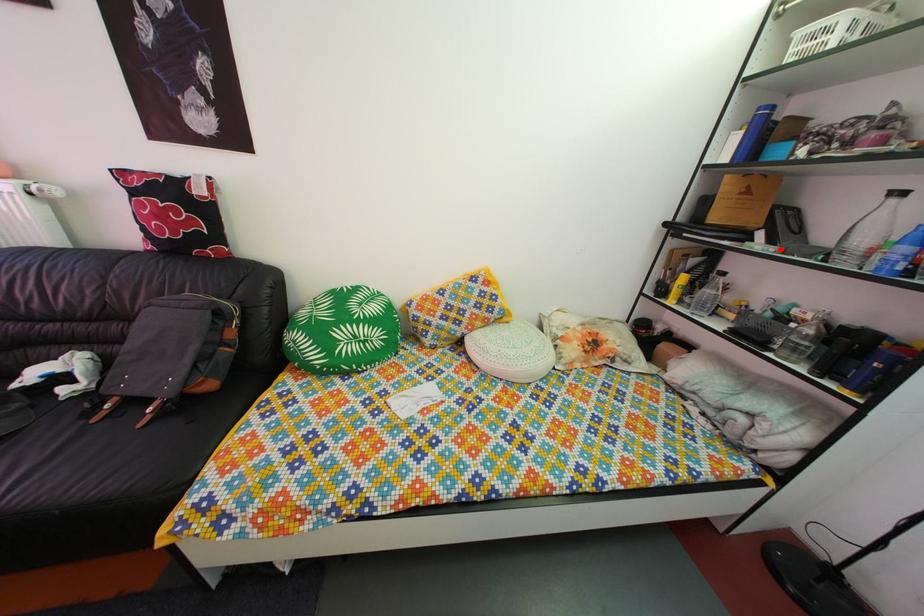
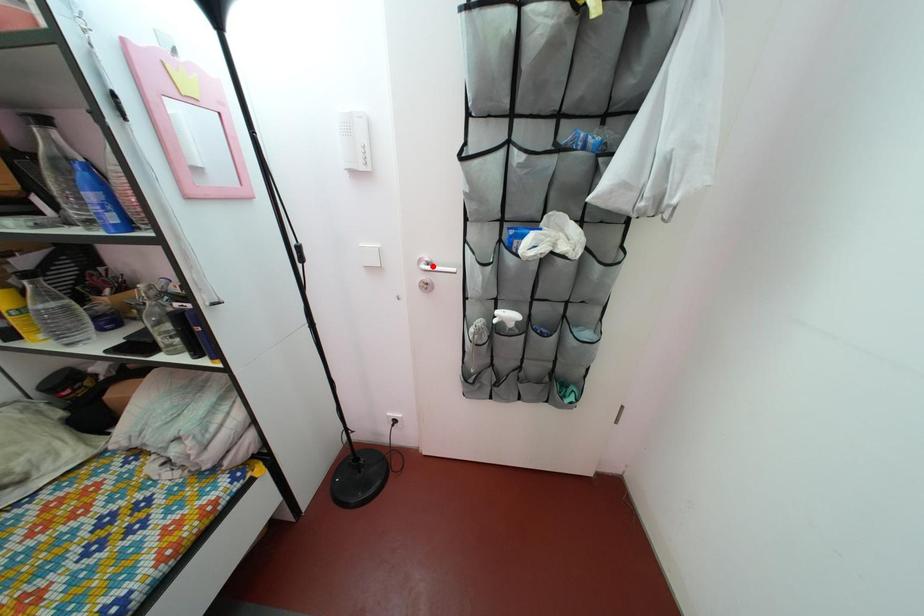
I am providing you with two images of the same scene from different viewpoints. A red point is marked on the first image and another point is marked on the second image. Does the point marked in image1 correspond to the same location as the one in image2?

No